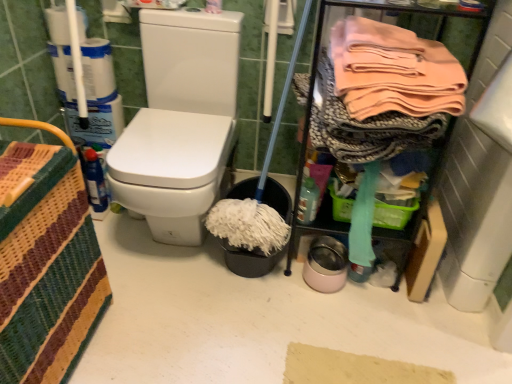
Describe the element at coordinates (50, 281) in the screenshot. I see `woven fabric basket at left` at that location.

What is the approximate height of pink fabric at upper right?

pink fabric at upper right is 12.16 inches in height.

Image resolution: width=512 pixels, height=384 pixels. What do you see at coordinates (308, 201) in the screenshot?
I see `translucent plastic bottle at lower right` at bounding box center [308, 201].

This screenshot has width=512, height=384. I want to click on woven fabric basket at left, so click(x=50, y=281).

Considering the relative sizes of woven fabric basket at left and pink fabric at upper right in the image provided, is woven fabric basket at left smaller than pink fabric at upper right?

No.

From a real-world perspective, is woven fabric basket at left located beneath pink fabric at upper right?

Yes, from a real-world perspective, woven fabric basket at left is below pink fabric at upper right.

Considering the sizes of objects woven fabric basket at left and pink fabric at upper right in the image provided, who is taller, woven fabric basket at left or pink fabric at upper right?

woven fabric basket at left is taller.

Which is in front, white matte toilet paper at upper left or woven fabric basket at left?

woven fabric basket at left is more forward.

Would you say white matte toilet paper at upper left is inside or outside woven fabric basket at left?

white matte toilet paper at upper left is outside woven fabric basket at left.

From the image's perspective, is white matte toilet paper at upper left on top of woven fabric basket at left?

Yes, from the image's perspective, white matte toilet paper at upper left is on top of woven fabric basket at left.

Does white matte toilet paper at upper left appear on the right side of woven fabric basket at left?

Incorrect, white matte toilet paper at upper left is not on the right side of woven fabric basket at left.

Is pink fabric at upper right oriented towards white matte toilet paper at upper left?

No.

Can you confirm if pink fabric at upper right is taller than white matte toilet paper at upper left?

Yes.

Measure the distance from pink fabric at upper right to white matte toilet paper at upper left.

pink fabric at upper right is 3.65 feet away from white matte toilet paper at upper left.

Is white matte toilet paper at upper left surrounded by pink fabric at upper right?

Actually, white matte toilet paper at upper left is outside pink fabric at upper right.

Is translucent plastic bottle at lower right with pink fabric at upper right?

translucent plastic bottle at lower right and pink fabric at upper right are clearly separated.

From a real-world perspective, who is located lower, translucent plastic bottle at lower right or pink fabric at upper right?

→ In real-world perspective, translucent plastic bottle at lower right is lower.

Does point (311, 192) lie in front of point (372, 77)?

No, (311, 192) is further to viewer.

Between translucent plastic bottle at lower right and pink fabric at upper right, which one has smaller width?

Thinner between the two is translucent plastic bottle at lower right.

Is translucent plastic bottle at lower right taller than woven fabric basket at left?

No, translucent plastic bottle at lower right is not taller than woven fabric basket at left.

Is translucent plastic bottle at lower right looking in the opposite direction of woven fabric basket at left?

No, translucent plastic bottle at lower right's orientation is not away from woven fabric basket at left.

Can you confirm if translucent plastic bottle at lower right is thinner than woven fabric basket at left?

Yes, translucent plastic bottle at lower right is thinner than woven fabric basket at left.

Is translucent plastic bottle at lower right beside woven fabric basket at left?

They are not placed beside each other.

Would you say translucent plastic bottle at lower right is inside or outside white matte toilet paper at upper left?

translucent plastic bottle at lower right exists outside the volume of white matte toilet paper at upper left.

You are a GUI agent. You are given a task and a screenshot of the screen. Output one action in this format:
    pyautogui.click(x=<x>, y=<y>)
    Task: Click on the toilet paper located on the left of translucent plastic bottle at lower right
    This screenshot has width=512, height=384.
    Given the screenshot: What is the action you would take?
    pyautogui.click(x=58, y=25)

Considering the sizes of translucent plastic bottle at lower right and white matte toilet paper at upper left in the image, is translucent plastic bottle at lower right wider or thinner than white matte toilet paper at upper left?

Considering their sizes, translucent plastic bottle at lower right looks slimmer than white matte toilet paper at upper left.

Is white matte toilet paper at upper left touching pink fabric at upper right?

white matte toilet paper at upper left and pink fabric at upper right are not in contact.

Which is less distant, (61, 35) or (340, 96)?

Point (61, 35).

From a real-world perspective, which is physically above, white matte toilet paper at upper left or pink fabric at upper right?

pink fabric at upper right.

From the image's perspective, which object appears higher, white matte toilet paper at upper left or pink fabric at upper right?

white matte toilet paper at upper left, from the image's perspective.

Find the location of `basket located below the pink fabric at upper right (from the image's perspective)`. basket located below the pink fabric at upper right (from the image's perspective) is located at coordinates (50, 281).

You are a GUI agent. You are given a task and a screenshot of the screen. Output one action in this format:
    pyautogui.click(x=<x>, y=<y>)
    Task: Click on the toilet paper to the left of woven fabric basket at left
    
    Given the screenshot: What is the action you would take?
    click(58, 25)

Looking at the image, which one is located closer to white matte toilet paper at upper left, pink fabric at upper right or woven fabric basket at left?

Based on the image, woven fabric basket at left appears to be nearer to white matte toilet paper at upper left.

Which object lies nearer to the anchor point pink fabric at upper right, translucent plastic bottle at lower right or woven fabric basket at left?

translucent plastic bottle at lower right is closer to pink fabric at upper right.

Looking at the image, which one is located closer to pink fabric at upper right, translucent plastic bottle at lower right or white matte toilet paper at upper left?

Among the two, translucent plastic bottle at lower right is located nearer to pink fabric at upper right.

In the scene shown: Based on their spatial positions, is translucent plastic bottle at lower right or pink fabric at upper right closer to white matte toilet paper at upper left?

translucent plastic bottle at lower right lies closer to white matte toilet paper at upper left than the other object.

Estimate the real-world distances between objects in this image. Which object is further from woven fabric basket at left, white matte toilet paper at upper left or pink fabric at upper right?

Among the two, white matte toilet paper at upper left is located further to woven fabric basket at left.

From the image, which object appears to be nearer to woven fabric basket at left, translucent plastic bottle at lower right or white matte toilet paper at upper left?

Based on the image, translucent plastic bottle at lower right appears to be nearer to woven fabric basket at left.

Looking at the image, which one is located further to pink fabric at upper right, woven fabric basket at left or translucent plastic bottle at lower right?

woven fabric basket at left is positioned further to the anchor pink fabric at upper right.

Considering their positions, is pink fabric at upper right positioned further to woven fabric basket at left than translucent plastic bottle at lower right?

pink fabric at upper right.

Image resolution: width=512 pixels, height=384 pixels. In order to click on bottle between woven fabric basket at left and pink fabric at upper right from left to right in this screenshot , I will do `click(308, 201)`.

This screenshot has height=384, width=512. In order to click on basket between white matte toilet paper at upper left and translucent plastic bottle at lower right in the horizontal direction in this screenshot , I will do `click(50, 281)`.

Where is `basket located between white matte toilet paper at upper left and pink fabric at upper right in the left-right direction`? basket located between white matte toilet paper at upper left and pink fabric at upper right in the left-right direction is located at coordinates (50, 281).

This screenshot has height=384, width=512. I want to click on bottle between white matte toilet paper at upper left and pink fabric at upper right from left to right, so click(x=308, y=201).